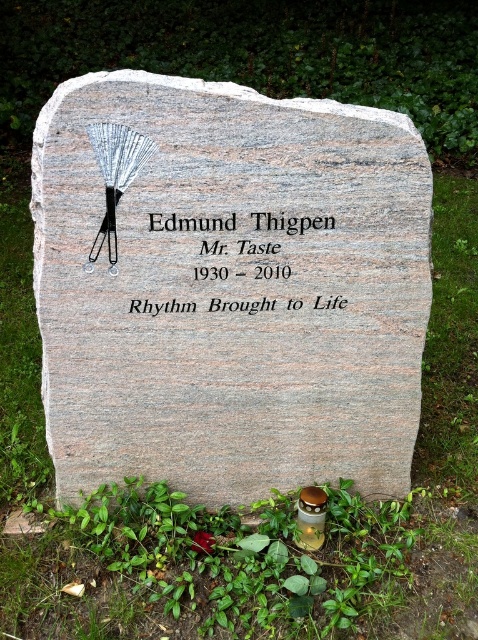
Question: Can you confirm if green grass at upper center is positioned above black granite stone at center?

Choices:
 (A) yes
 (B) no

Answer: (B)

Question: Which point is farther to the camera?

Choices:
 (A) (308, 227)
 (B) (123, 588)

Answer: (B)

Question: Can you confirm if green grass at upper center is positioned above black granite stone at center?

Choices:
 (A) no
 (B) yes

Answer: (A)

Question: Can you confirm if green grass at upper center is positioned above black granite stone at center?

Choices:
 (A) yes
 (B) no

Answer: (B)